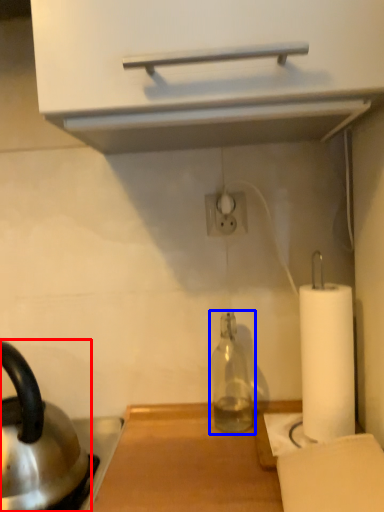
Question: Which of the following is the farthest to the observer, kettle (highlighted by a red box) or bottle (highlighted by a blue box)?

Choices:
 (A) kettle
 (B) bottle

Answer: (B)